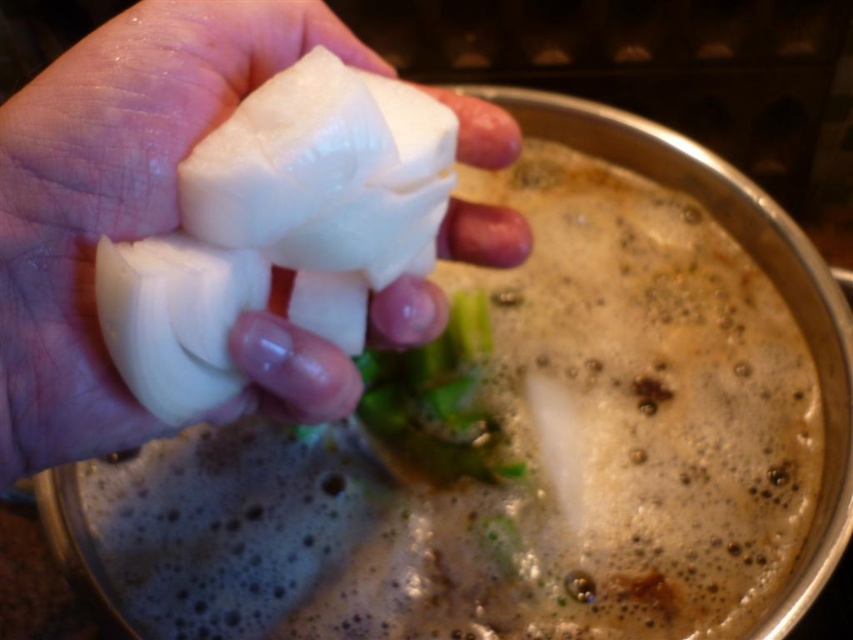
Question: Does white matte onion at center appear under green leafy at center?

Choices:
 (A) no
 (B) yes

Answer: (A)

Question: Which point is closer to the camera?

Choices:
 (A) white matte onion at center
 (B) green leafy at center

Answer: (A)

Question: Observing the image, what is the correct spatial positioning of white matte onion at center in reference to green leafy at center?

Choices:
 (A) above
 (B) below

Answer: (A)

Question: Can you confirm if white matte onion at center is thinner than green leafy at center?

Choices:
 (A) no
 (B) yes

Answer: (A)